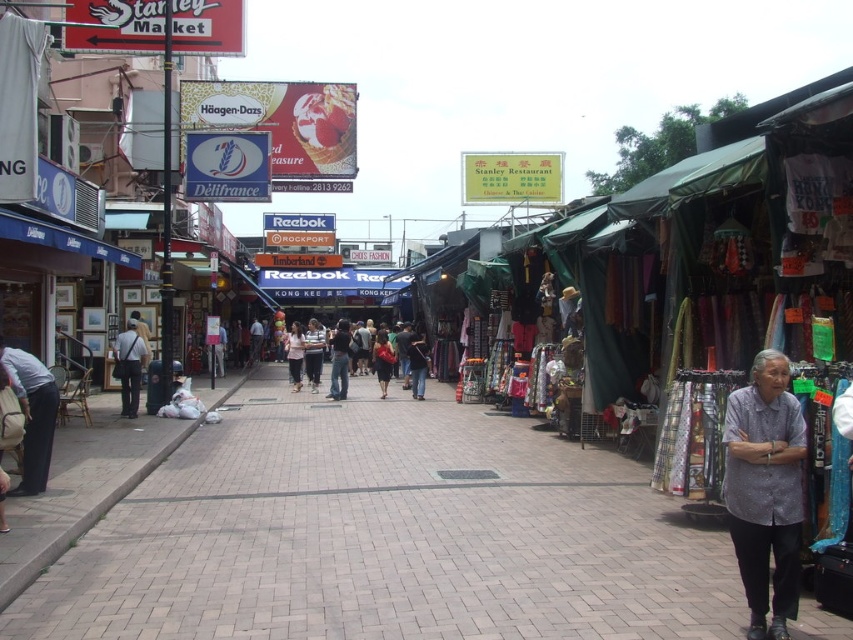
Question: Estimate the real-world distances between objects in this image. Which object is farther from the purple cotton shirt at lower right?

Choices:
 (A) brick pavement at center
 (B) red fabric bag at center
 (C) light blue jeans at center

Answer: (C)

Question: Is purple cotton shirt at lower right positioned before white cotton shirt at center?

Choices:
 (A) no
 (B) yes

Answer: (B)

Question: Is purple cotton shirt at lower right smaller than red fabric bag at center?

Choices:
 (A) no
 (B) yes

Answer: (A)

Question: Among these objects, which one is nearest to the camera?

Choices:
 (A) red fabric bag at center
 (B) brick pavement at center
 (C) purple cotton shirt at lower right

Answer: (C)

Question: Is purple cotton shirt at lower right positioned in front of white cotton shirt at center?

Choices:
 (A) yes
 (B) no

Answer: (A)

Question: Which of these objects is positioned closest to the purple cotton shirt at lower right?

Choices:
 (A) red fabric bag at center
 (B) light blue jeans at center
 (C) brick pavement at center
 (D) white cotton shirt at center

Answer: (C)